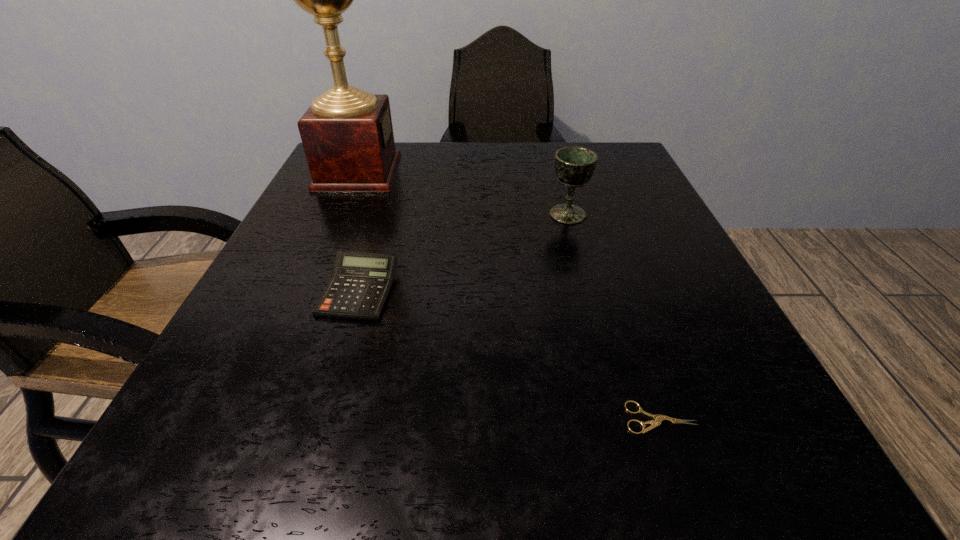
I want to click on the tallest object, so click(347, 134).

This screenshot has height=540, width=960. I want to click on the second tallest object, so click(574, 166).

Locate an element on the screen. The image size is (960, 540). calculator is located at coordinates point(360,284).

Identify the location of the third tallest object. The height and width of the screenshot is (540, 960). [360, 284].

Image resolution: width=960 pixels, height=540 pixels. In order to click on the shortest object in this screenshot , I will do `click(658, 419)`.

Locate an element on the screen. shears is located at coordinates (658, 419).

Find the location of a particular element. The image size is (960, 540). vacant space located 0.170m on the plaque of the trophy cup is located at coordinates (469, 172).

Identify the location of free space located on the front of the third shortest object. This screenshot has width=960, height=540. (580, 258).

Find the location of a particular element. This screenshot has height=540, width=960. free space located 0.060m on the back of the second nearest object is located at coordinates (373, 244).

Where is `free space located 0.310m on the left of the shortest object`? free space located 0.310m on the left of the shortest object is located at coordinates (372, 418).